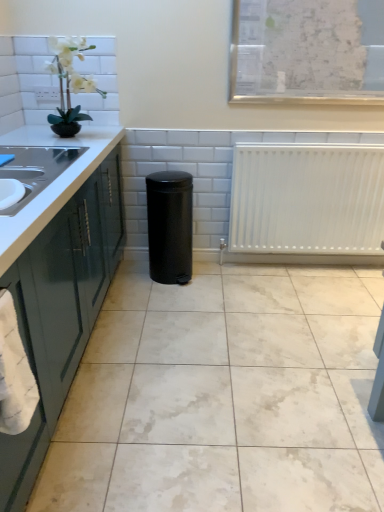
The height and width of the screenshot is (512, 384). I want to click on free space in front of black matte trash can at center, so click(178, 300).